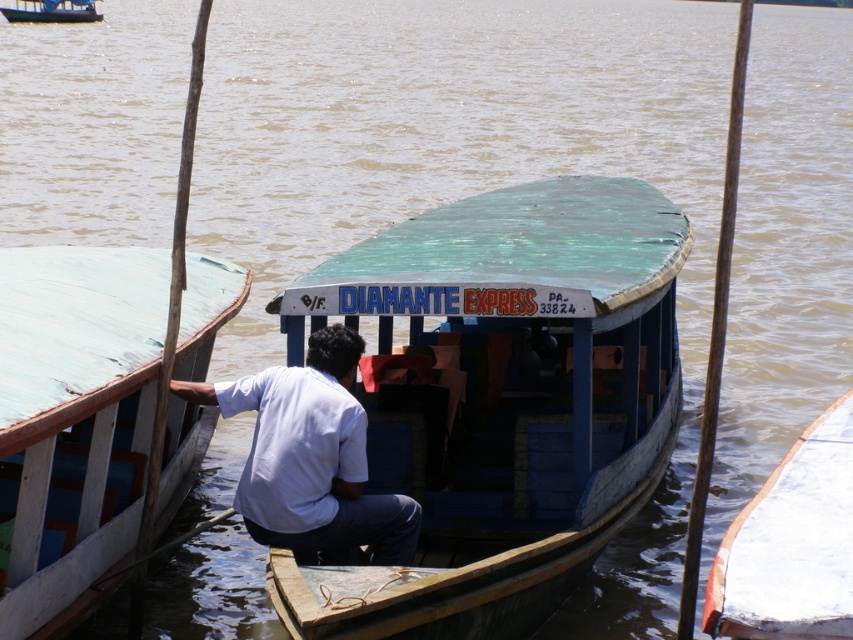
Question: Does white matte shirt at center have a lesser width compared to white glossy boat at lower right?

Choices:
 (A) no
 (B) yes

Answer: (A)

Question: Which point is closer to the camera?

Choices:
 (A) wooden boat at left
 (B) green matte boat at center
 (C) white matte shirt at center
 (D) white glossy boat at lower right

Answer: (D)

Question: Is teal wooden boat at center bigger than wooden boat at left?

Choices:
 (A) yes
 (B) no

Answer: (B)

Question: Which point appears farthest from the camera in this image?

Choices:
 (A) (77, 10)
 (B) (838, 632)

Answer: (A)

Question: Which of these objects is positioned farthest from the green matte boat at center?

Choices:
 (A) wooden boat at left
 (B) teal wooden boat at center

Answer: (B)

Question: Does teal wooden boat at center appear on the right side of white glossy boat at lower right?

Choices:
 (A) yes
 (B) no

Answer: (B)